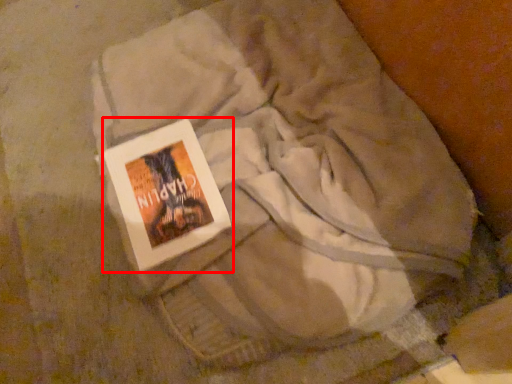
Question: Observing the image, what is the correct spatial positioning of book (annotated by the red box) in reference to textile?

Choices:
 (A) right
 (B) left

Answer: (B)